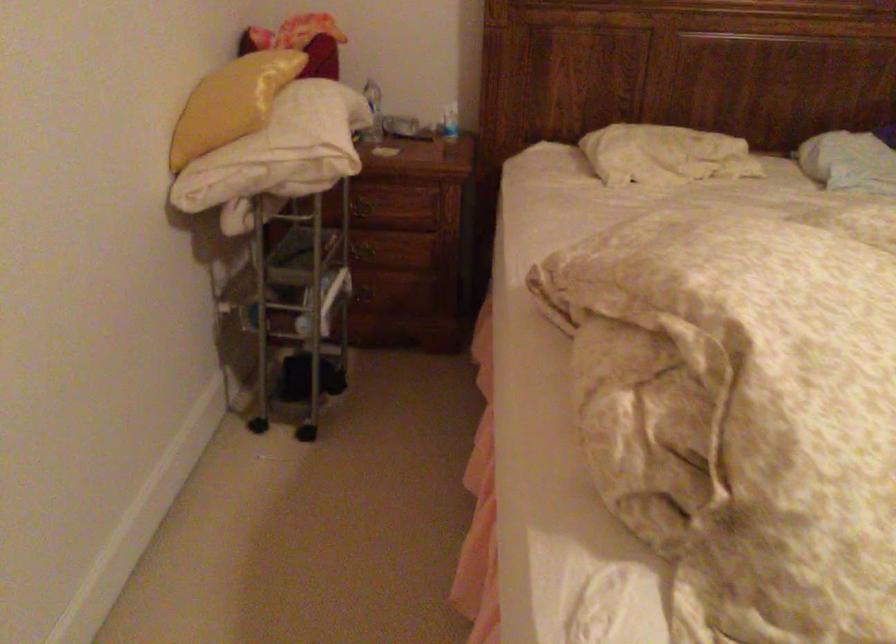
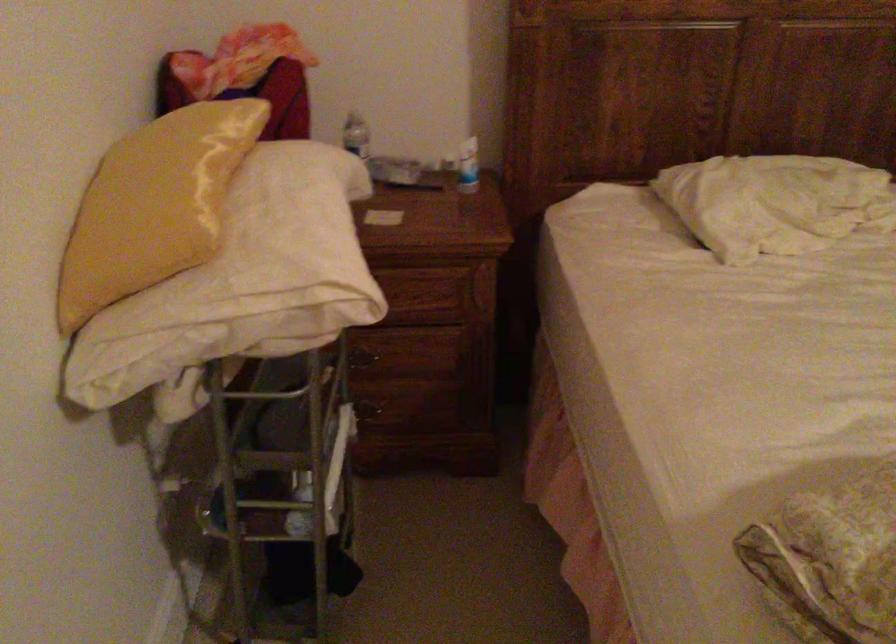
Question: In a continuous first-person perspective shot, in which direction is the camera moving?

Choices:
 (A) Left
 (B) Right
 (C) Forward
 (D) Backward

Answer: (C)